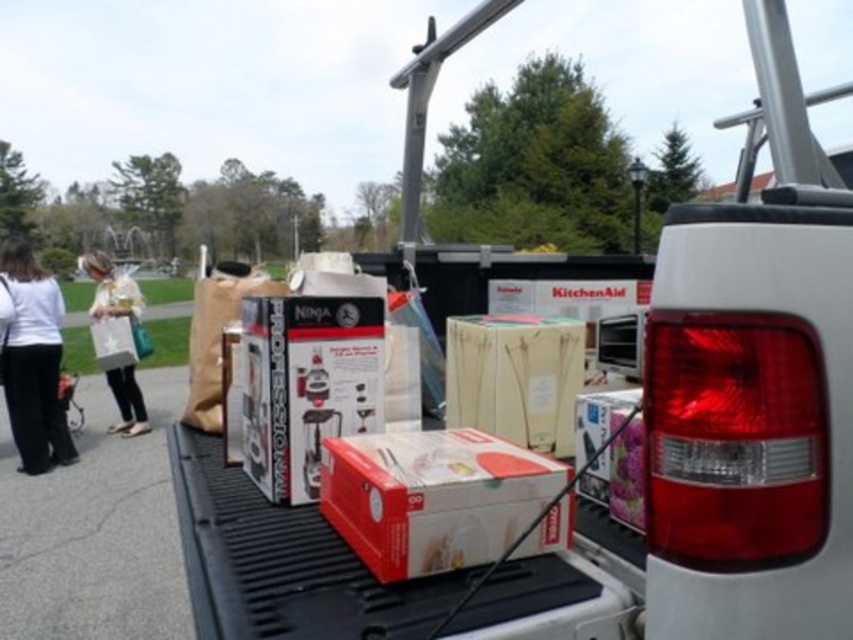
You are helping organize items in the truck bed. You have to place the red matte cardboard box at center and the white paper bag at left. Which one requires more vertical space due to its height?

The white paper bag at left requires more vertical space because it is thicker than the red matte cardboard box at center.

You are standing in front of the pickup truck at a garage sale and notice the white cotton shirt at left. If you want to reach it, which direction should you move relative to your current position?

The white cotton shirt at left is located at point 0.562 on the x axis and 0.039 on the y axis. Since the x coordinate is 0.562, which is more than halfway to the right side of the image, you should move to the right to reach it.

You are organizing items in the truck bed and need to place the red matte cardboard box at center and the white paper bag at left. According to their positions, which item is closer to the left side of the truck bed?

The white paper bag at left is closer to the left side of the truck bed because it is positioned to the left of the red matte cardboard box at center.